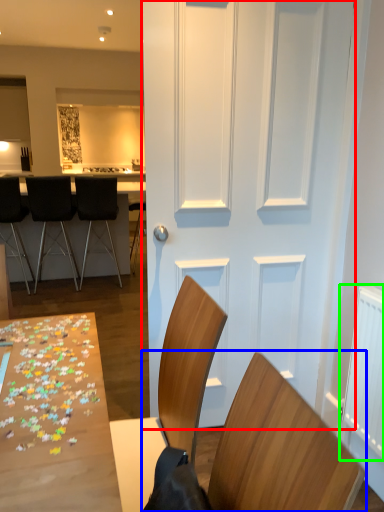
Question: Which is farther away from door (highlighted by a red box)? chair (highlighted by a blue box) or radiator (highlighted by a green box)?

Choices:
 (A) chair
 (B) radiator

Answer: (A)